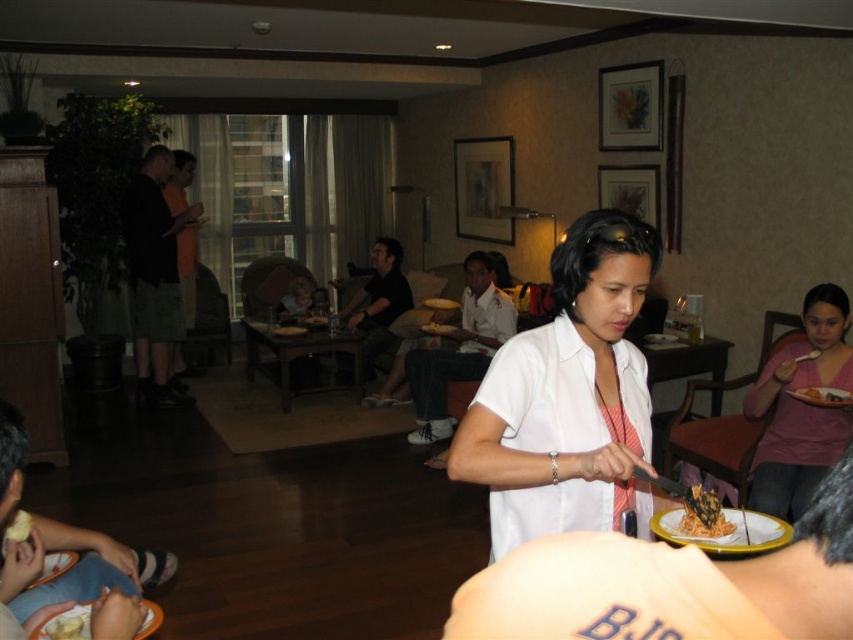
Question: Which point is closer to the camera?

Choices:
 (A) (184, 168)
 (B) (71, 625)
 (C) (149, 627)
 (D) (679, 524)

Answer: (D)

Question: Does white glossy plate at center lie behind white matte plate at lower left?

Choices:
 (A) yes
 (B) no

Answer: (B)

Question: Can you confirm if pink matte shirt at lower right is thinner than yellow creamy food at lower left?

Choices:
 (A) yes
 (B) no

Answer: (B)

Question: Based on their relative distances, which object is nearer to the white matte plate at lower left?

Choices:
 (A) black cotton shirt at left
 (B) white glossy plate at center

Answer: (B)

Question: Based on their relative distances, which object is nearer to the white matte plate at right?

Choices:
 (A) golden crispy noodles at center
 (B) white matte plate at center

Answer: (A)

Question: Is white matte plate at right thinner than yellow creamy food at lower left?

Choices:
 (A) no
 (B) yes

Answer: (A)